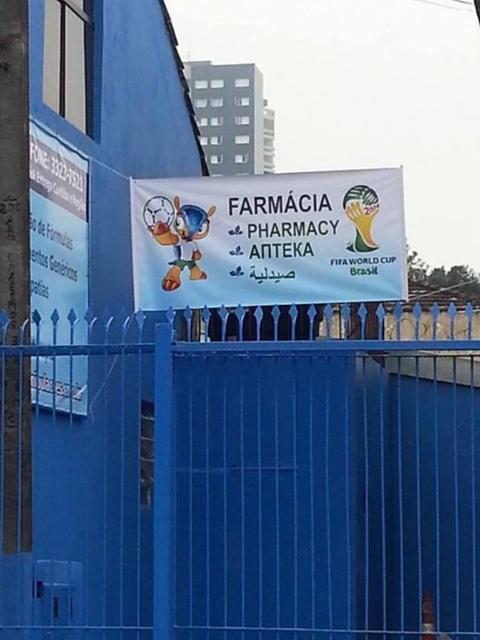
Question: Which point is farther to the camera?

Choices:
 (A) (336, 180)
 (B) (122, 458)

Answer: (B)

Question: Among these points, which one is farthest from the camera?

Choices:
 (A) 276,628
 (B) 363,248

Answer: (B)

Question: Does blue metal fence at center have a greater width compared to white fabric banner at center?

Choices:
 (A) yes
 (B) no

Answer: (A)

Question: From the image, what is the correct spatial relationship of blue metal fence at center in relation to white fabric banner at center?

Choices:
 (A) below
 (B) above

Answer: (A)

Question: Does blue metal fence at center have a smaller size compared to white fabric banner at center?

Choices:
 (A) no
 (B) yes

Answer: (A)

Question: Which point appears closest to the camera in this image?

Choices:
 (A) pos(391,300)
 (B) pos(319,337)

Answer: (A)